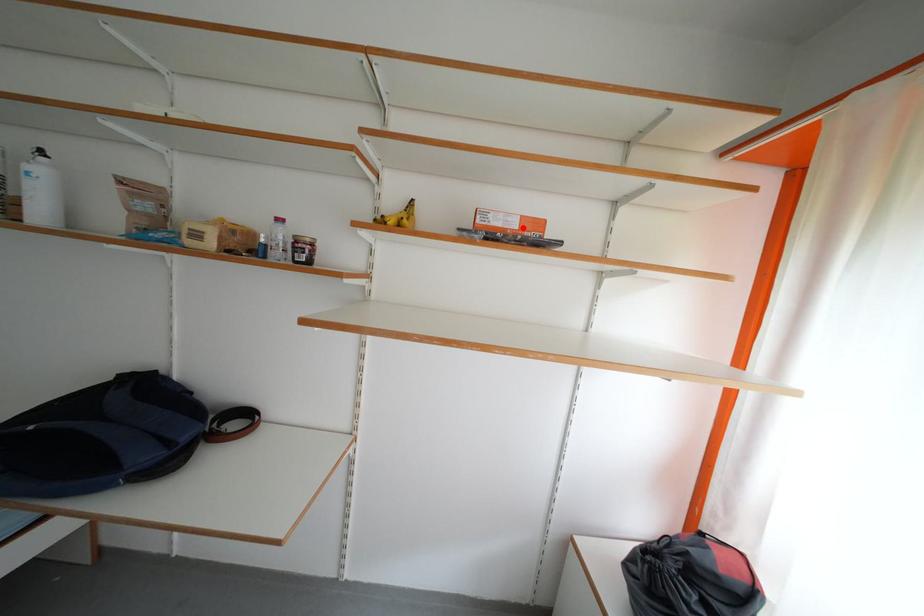
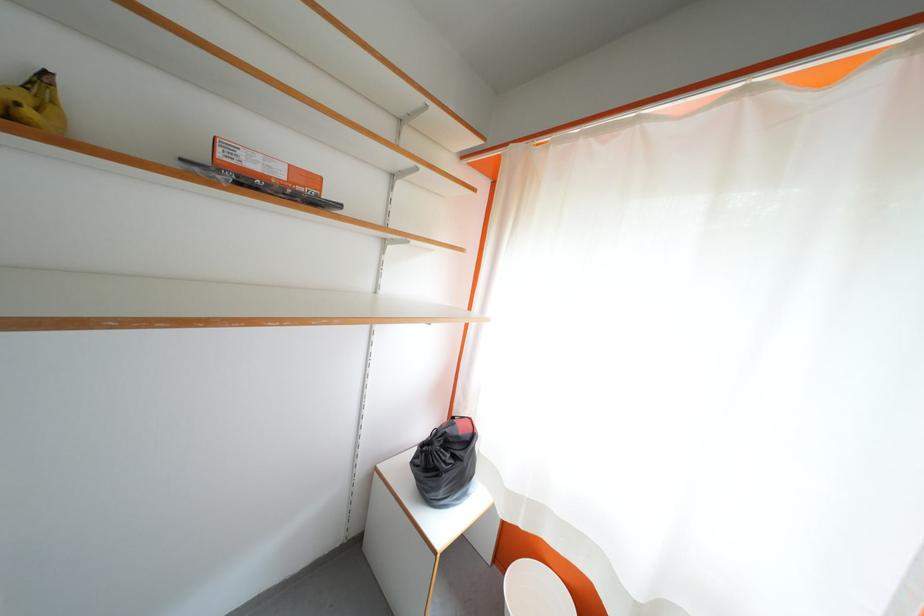
Question: I am providing you with two images of the same scene from different viewpoints. A red point is marked on the first image. Can you still see the location of the red point in image 2?

Choices:
 (A) Yes
 (B) No

Answer: (A)